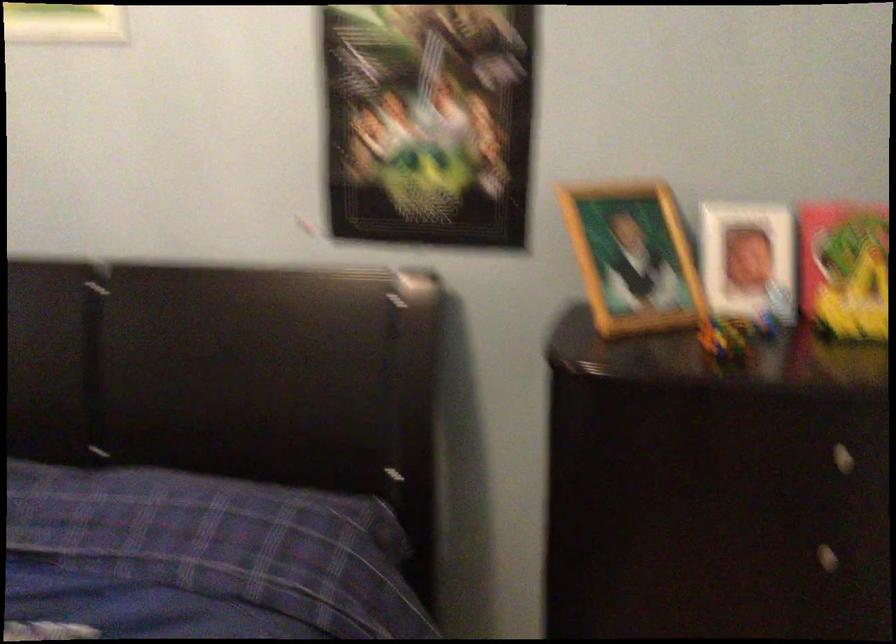
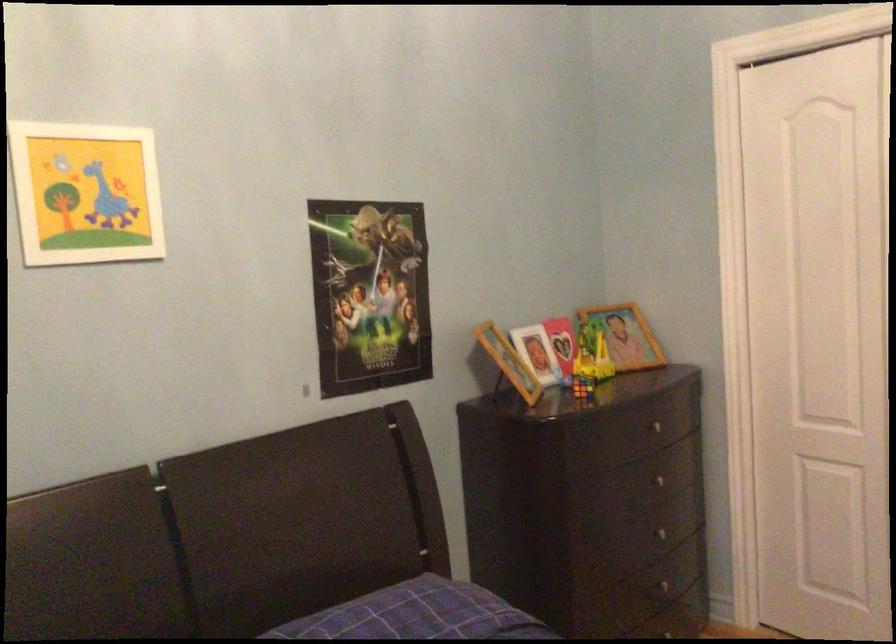
Where in the second image is the point corresponding to [812,538] from the first image?

(656, 480)